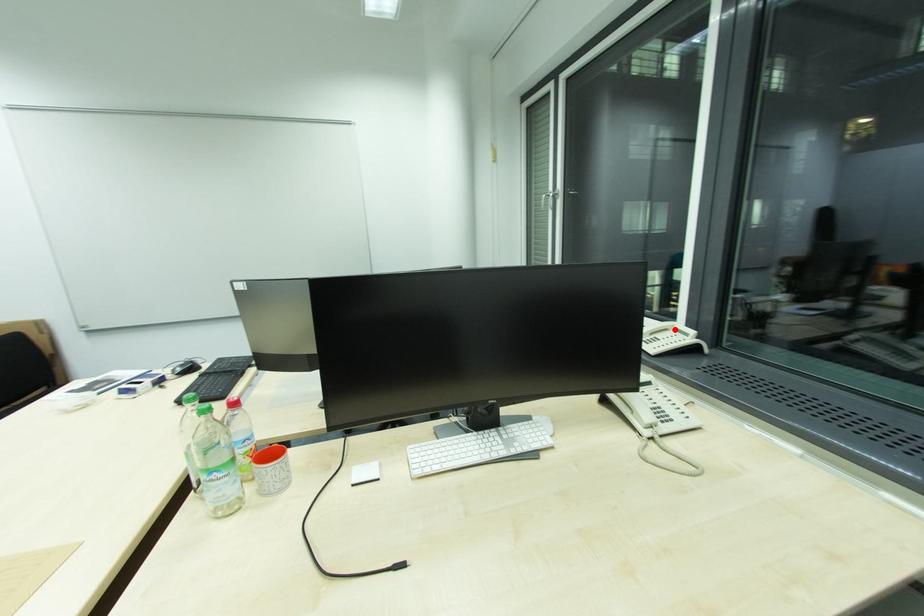
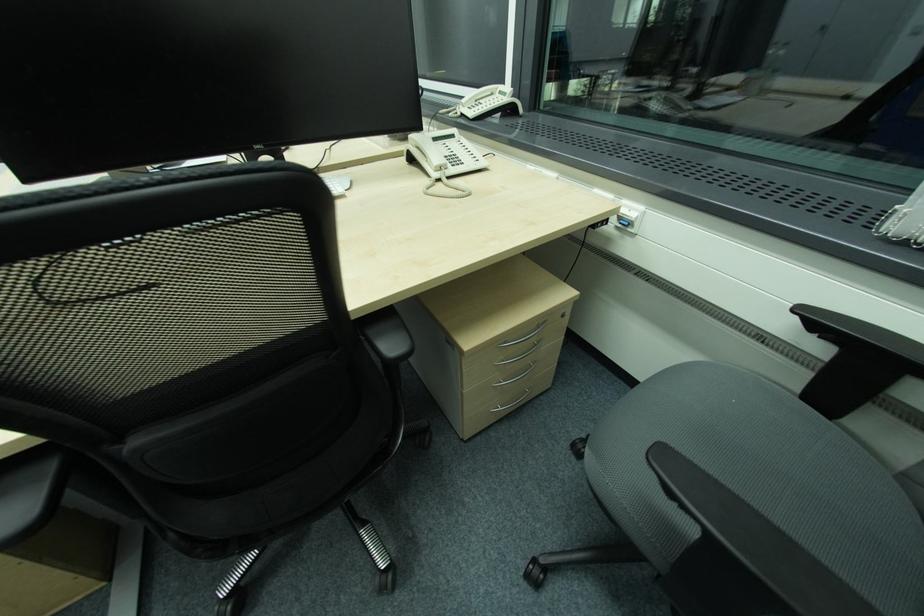
Question: I am providing you with two images of the same scene from different viewpoints. In image1, a red point is highlighted. Considering the same 3D point in image2, which of the following is correct?

Choices:
 (A) It is closer
 (B) It is farther

Answer: (A)